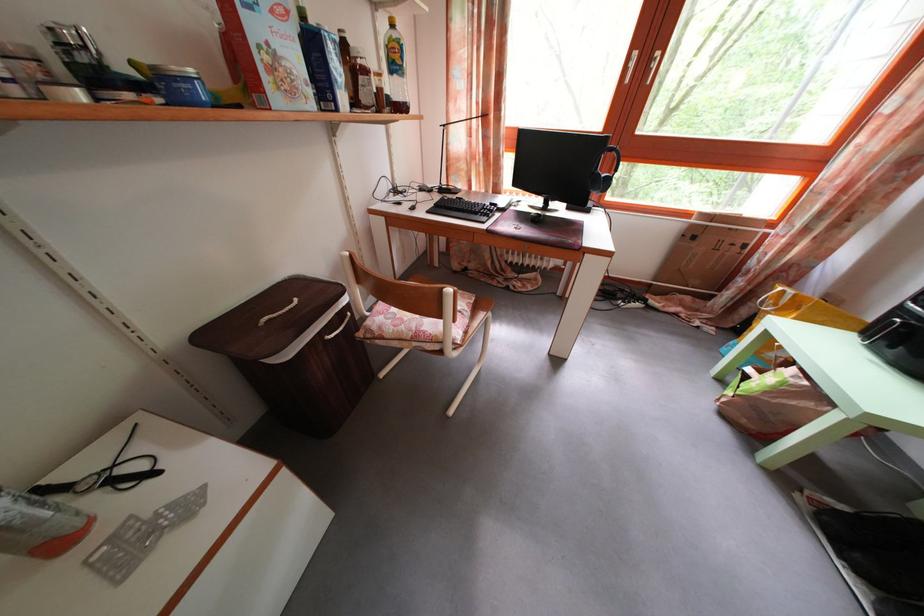
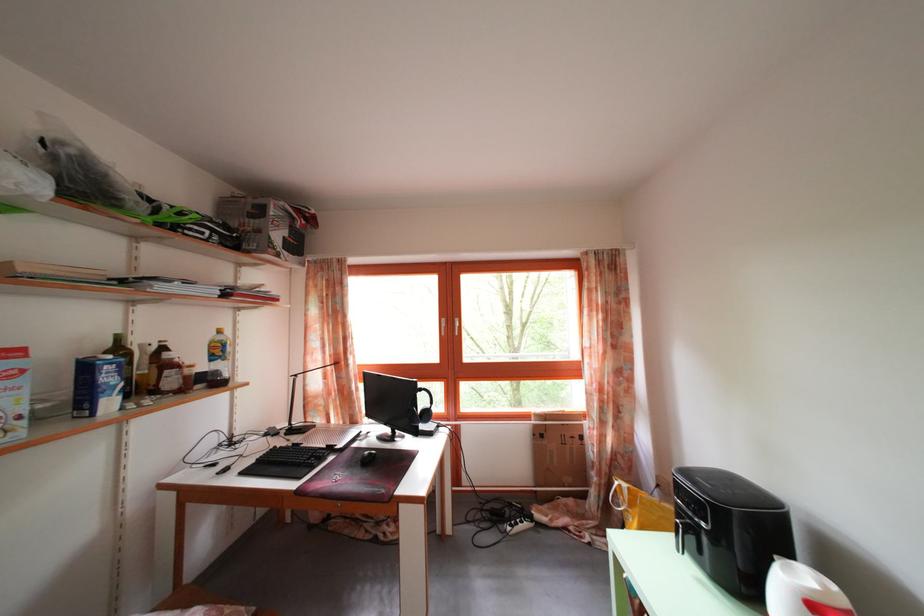
In the second image, find the point that corresponds to (x=699, y=233) in the first image.

(542, 432)